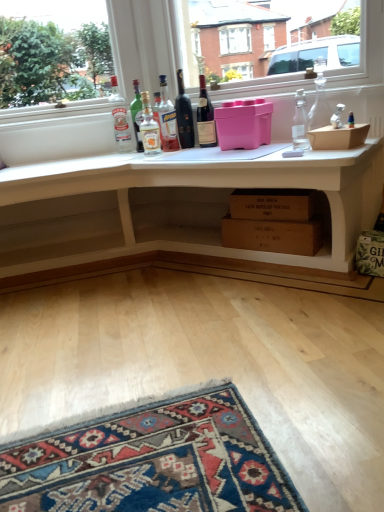
Question: From the image's perspective, is clear glass bottle at center, which ranks as the seventh bottle in right-to-left order, located above pink plastic container at center, which ranks as the 1th box in top-to-bottom order?

Choices:
 (A) yes
 (B) no

Answer: (A)

Question: Is clear glass bottle at center, which ranks as the seventh bottle in right-to-left order, to the left of pink plastic container at center, which ranks as the 1th box in top-to-bottom order, from the viewer's perspective?

Choices:
 (A) no
 (B) yes

Answer: (B)

Question: Is clear glass bottle at center, which ranks as the seventh bottle in right-to-left order, not within pink plastic container at center, which ranks as the 1th box in top-to-bottom order?

Choices:
 (A) no
 (B) yes

Answer: (B)

Question: Considering the relative sizes of clear glass bottle at center, which ranks as the seventh bottle in right-to-left order, and pink plastic container at center, which ranks as the 1th box in top-to-bottom order, in the image provided, is clear glass bottle at center, which ranks as the seventh bottle in right-to-left order, wider than pink plastic container at center, which ranks as the 1th box in top-to-bottom order,?

Choices:
 (A) yes
 (B) no

Answer: (B)

Question: Is clear glass bottle at center, placed as the 1th bottle when sorted from left to right, not near pink plastic container at center, marked as the second box in a bottom-to-top arrangement?

Choices:
 (A) no
 (B) yes

Answer: (A)

Question: From the image's perspective, is clear glass bottle at center, which ranks as the seventh bottle in right-to-left order, below pink plastic container at center, which ranks as the 1th box in top-to-bottom order?

Choices:
 (A) no
 (B) yes

Answer: (A)

Question: Is clear glass bottle at center, which ranks as the seventh bottle in right-to-left order, aimed at dark red glass wine bottle at center, the third bottle when ordered from right to left?

Choices:
 (A) no
 (B) yes

Answer: (A)

Question: Is clear glass bottle at center, which ranks as the seventh bottle in right-to-left order, looking in the opposite direction of dark red glass wine bottle at center, the third bottle when ordered from right to left?

Choices:
 (A) yes
 (B) no

Answer: (B)

Question: Considering the relative sizes of clear glass bottle at center, placed as the 1th bottle when sorted from left to right, and dark red glass wine bottle at center, the third bottle when ordered from right to left, in the image provided, is clear glass bottle at center, placed as the 1th bottle when sorted from left to right, shorter than dark red glass wine bottle at center, the third bottle when ordered from right to left,?

Choices:
 (A) yes
 (B) no

Answer: (B)

Question: Is clear glass bottle at center, which ranks as the seventh bottle in right-to-left order, in front of dark red glass wine bottle at center, placed as the 5th bottle when sorted from left to right?

Choices:
 (A) no
 (B) yes

Answer: (A)

Question: Does clear glass bottle at center, placed as the 1th bottle when sorted from left to right, have a larger size compared to dark red glass wine bottle at center, placed as the 5th bottle when sorted from left to right?

Choices:
 (A) yes
 (B) no

Answer: (A)

Question: Is clear glass bottle at center, placed as the 1th bottle when sorted from left to right, further to camera compared to dark red glass wine bottle at center, the third bottle when ordered from right to left?

Choices:
 (A) yes
 (B) no

Answer: (A)

Question: From a real-world perspective, does dark red glass wine bottle at center, the third bottle when ordered from right to left, sit lower than clear glass decanter at upper right, which is counted as the seventh bottle, starting from the left?

Choices:
 (A) no
 (B) yes

Answer: (A)